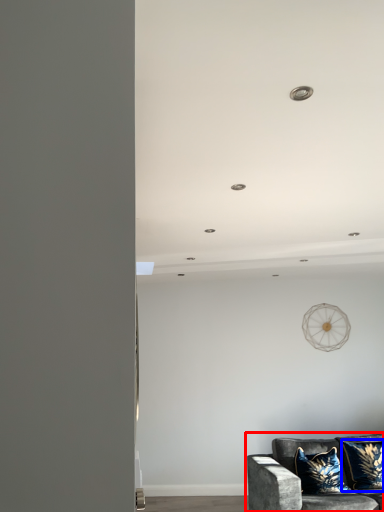
Question: Which of the following is the farthest to the observer, studio couch (highlighted by a red box) or pillow (highlighted by a blue box)?

Choices:
 (A) studio couch
 (B) pillow

Answer: (B)